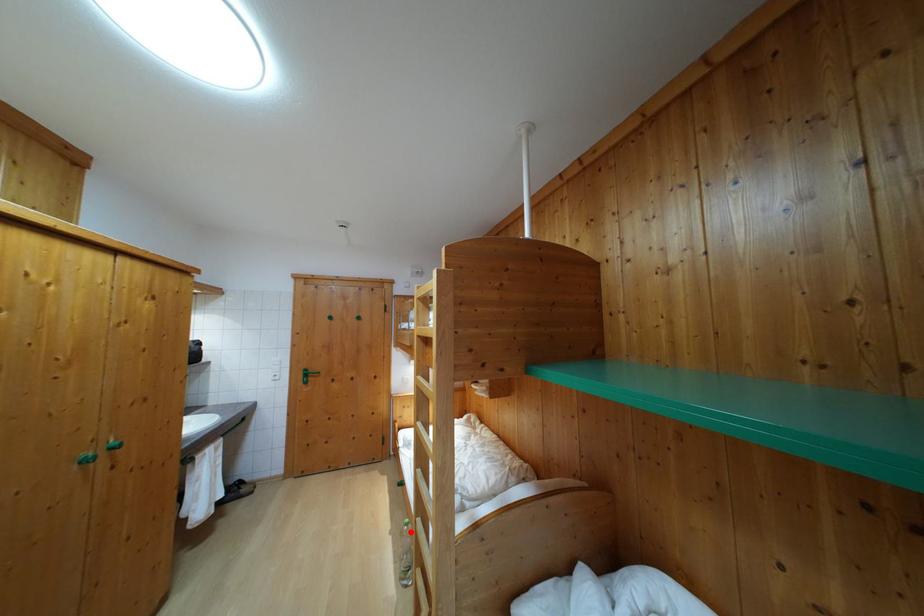
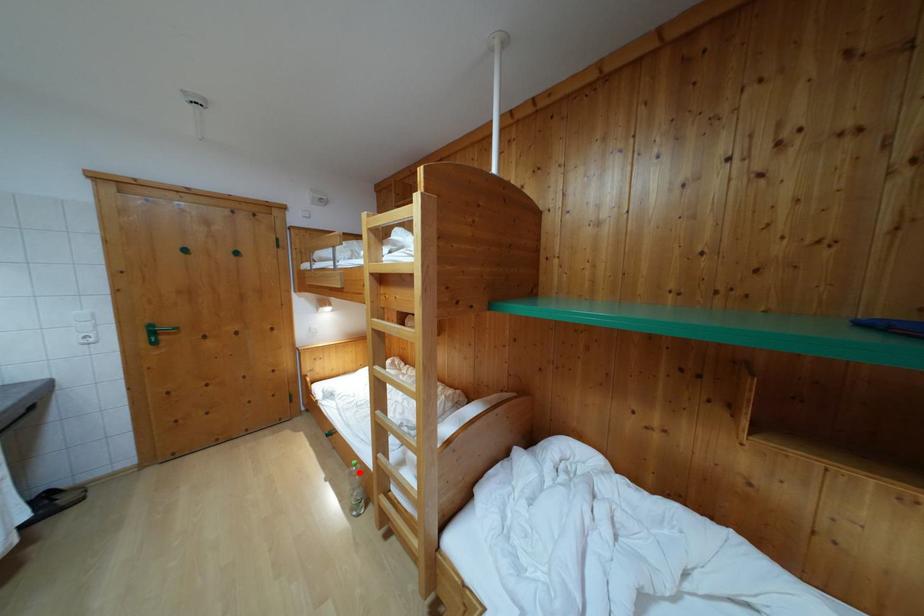
I am providing you with two images of the same scene from different viewpoints. A red point is marked on the first image and another point is marked on the second image. Does the point marked in image1 correspond to the same location as the one in image2?

Yes